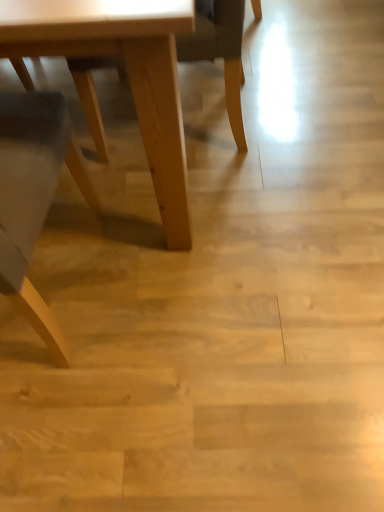
Locate an element on the screen. free space in front of light brown wood chair at center is located at coordinates (257, 197).